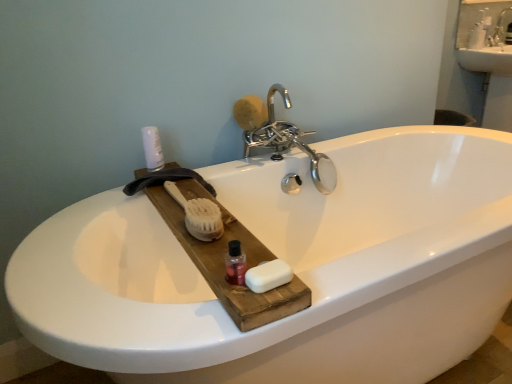
Question: Is chrome metallic faucet at upper center thinner than white matte spray can at upper left?

Choices:
 (A) no
 (B) yes

Answer: (A)

Question: Can you confirm if chrome metallic faucet at upper center is positioned to the left of white matte spray can at upper left?

Choices:
 (A) yes
 (B) no

Answer: (B)

Question: Would you say chrome metallic faucet at upper center is a long distance from white matte spray can at upper left?

Choices:
 (A) yes
 (B) no

Answer: (B)

Question: Is chrome metallic faucet at upper center facing towards white matte spray can at upper left?

Choices:
 (A) yes
 (B) no

Answer: (B)

Question: Is chrome metallic faucet at upper center positioned before white matte spray can at upper left?

Choices:
 (A) no
 (B) yes

Answer: (A)

Question: In terms of size, does white matte spray can at upper left appear bigger or smaller than white matte soap at center, positioned as the first soap in front-to-back order?

Choices:
 (A) small
 (B) big

Answer: (B)

Question: Is white matte spray can at upper left inside or outside of white matte soap at center, which is counted as the first soap, starting from the bottom?

Choices:
 (A) outside
 (B) inside

Answer: (A)

Question: From a real-world perspective, is white matte spray can at upper left positioned above or below white matte soap at center, the second soap when ordered from top to bottom?

Choices:
 (A) above
 (B) below

Answer: (A)

Question: Considering the positions of white matte spray can at upper left and white matte soap at center, which is counted as the first soap, starting from the bottom, in the image, is white matte spray can at upper left wider or thinner than white matte soap at center, which is counted as the first soap, starting from the bottom,?

Choices:
 (A) thin
 (B) wide

Answer: (B)

Question: Relative to white matte spray can at upper left, is white natural wood brush at center in front or behind?

Choices:
 (A) front
 (B) behind

Answer: (A)

Question: Based on their positions, is white natural wood brush at center located to the left or right of white matte spray can at upper left?

Choices:
 (A) right
 (B) left

Answer: (A)

Question: From a real-world perspective, relative to white matte spray can at upper left, is white natural wood brush at center vertically above or below?

Choices:
 (A) below
 (B) above

Answer: (A)

Question: Looking at their shapes, would you say white natural wood brush at center is wider or thinner than white matte spray can at upper left?

Choices:
 (A) wide
 (B) thin

Answer: (A)

Question: Looking at their shapes, would you say white natural wood brush at center is wider or thinner than chrome metallic faucet at upper center?

Choices:
 (A) wide
 (B) thin

Answer: (A)

Question: From their relative heights in the image, would you say white natural wood brush at center is taller or shorter than chrome metallic faucet at upper center?

Choices:
 (A) short
 (B) tall

Answer: (A)